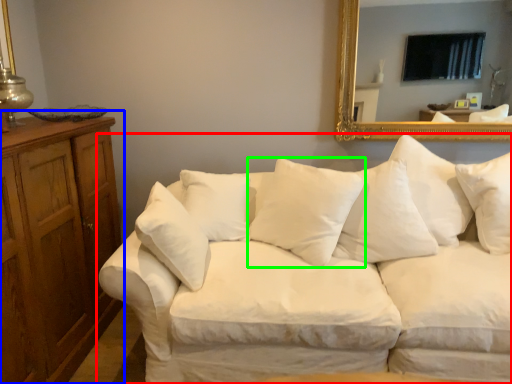
Question: Considering the real-world distances, which object is farthest from studio couch (highlighted by a red box)? dresser (highlighted by a blue box) or pillow (highlighted by a green box)?

Choices:
 (A) dresser
 (B) pillow

Answer: (A)